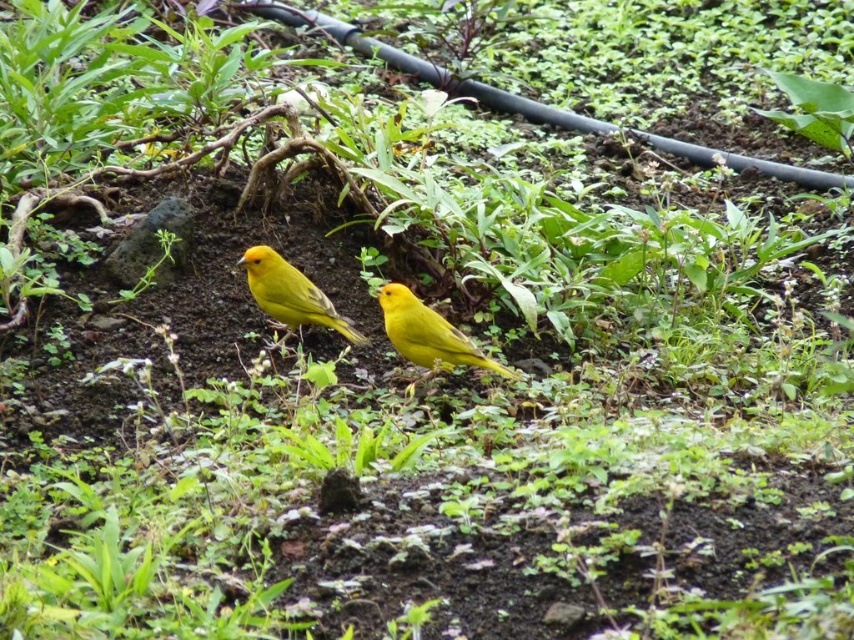
Does point (487, 364) come farther from viewer compared to point (317, 321)?

No, it is not.

Who is positioned more to the right, bright yellow bird at center or matte yellow bird at center?

Positioned to the right is bright yellow bird at center.

At what (x,y) coordinates should I click in order to perform the action: click on bright yellow bird at center. Please return your answer as a coordinate pair (x, y). This screenshot has width=854, height=640. Looking at the image, I should click on (427, 336).

The height and width of the screenshot is (640, 854). Find the location of `bright yellow bird at center`. bright yellow bird at center is located at coordinates (427, 336).